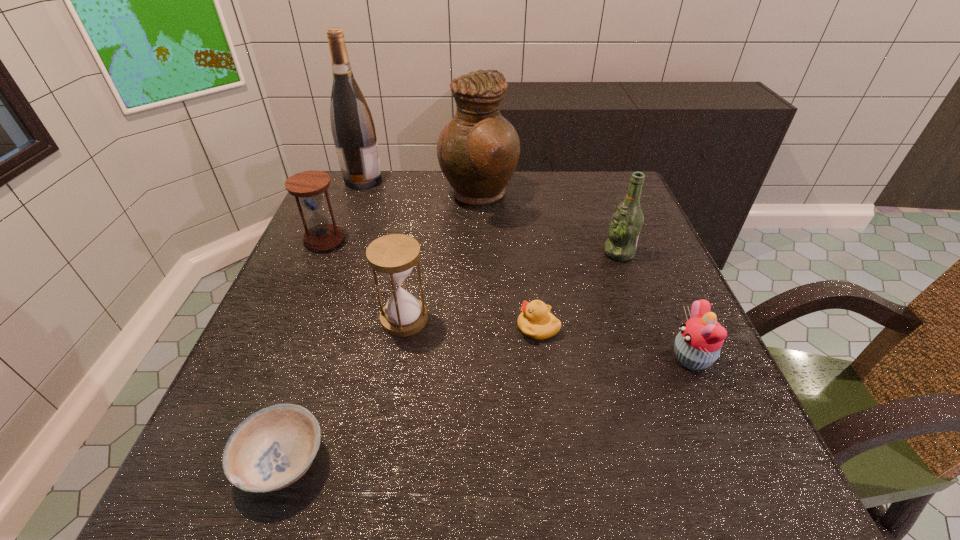
Identify the location of free spot located 0.230m on the front-facing side of the duckling. The width and height of the screenshot is (960, 540). (396, 327).

In order to click on vacant area located on the front-facing side of the duckling in this screenshot , I will do `click(491, 327)`.

What are the coordinates of `vacant space located 0.300m on the back of the bowl` in the screenshot? It's located at (341, 291).

The height and width of the screenshot is (540, 960). I want to click on wine bottle that is at the far edge, so click(352, 126).

Identify the location of pitcher that is at the far edge. This screenshot has width=960, height=540. (478, 150).

Identify the location of object that is at the near edge. (271, 449).

You are a GUI agent. You are given a task and a screenshot of the screen. Output one action in this format:
    pyautogui.click(x=<x>, y=<y>)
    Task: Click on the wine bottle situated at the left edge
    Image resolution: width=960 pixels, height=540 pixels.
    Given the screenshot: What is the action you would take?
    coord(352,126)

At what (x,y) coordinates should I click in order to perform the action: click on hourglass at the left edge. Please return your answer as a coordinate pair (x, y). The image size is (960, 540). Looking at the image, I should click on (308, 185).

The width and height of the screenshot is (960, 540). Find the location of `bowl that is at the left edge`. bowl that is at the left edge is located at coordinates (271, 449).

At what (x,y) coordinates should I click in order to perform the action: click on beer bottle present at the right edge. Please return your answer as a coordinate pair (x, y). The image size is (960, 540). Looking at the image, I should click on (625, 226).